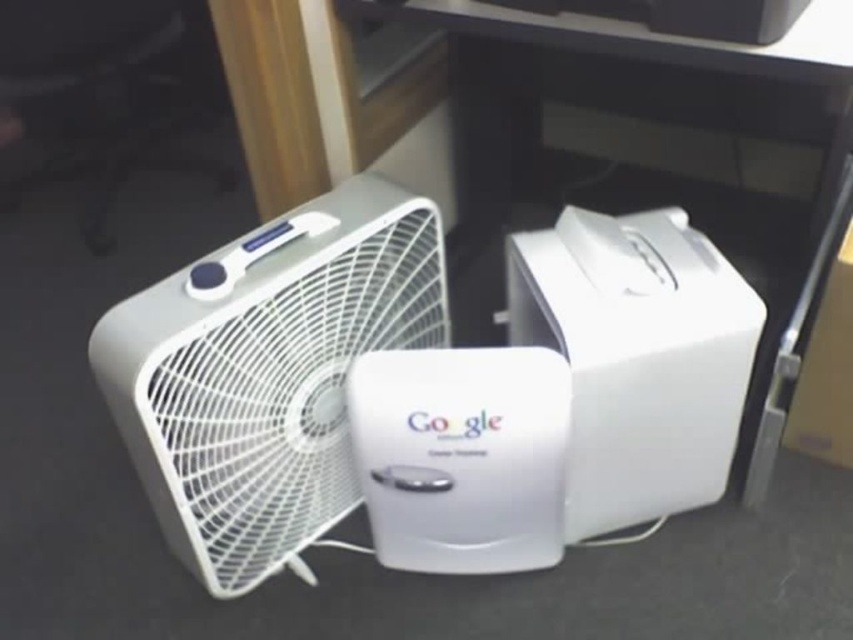
You are setting up a desk organizer and need to know the relative sizes of the items. Which object is wider between the white plastic computer desk at center and the white plastic fan at center?

The white plastic computer desk at center is wider than the white plastic fan at center according to the description.

You are setting up a desk in your home office and have a white plastic computer desk at center and a white plastic fan at center. Which object should you place closer to the wall to ensure there is enough space for both?

The white plastic computer desk at center should be placed closer to the wall because it is positioned on the right side of the white plastic fan at center, meaning the fan is to the left of the desk. By placing the desk near the wall, the fan can be positioned to the left of it, allowing both items to fit within the space.